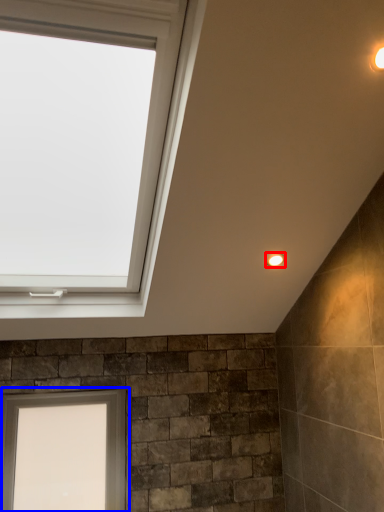
Question: Which object appears closest to the camera in this image, light fixture (highlighted by a red box) or window (highlighted by a blue box)?

Choices:
 (A) light fixture
 (B) window

Answer: (A)